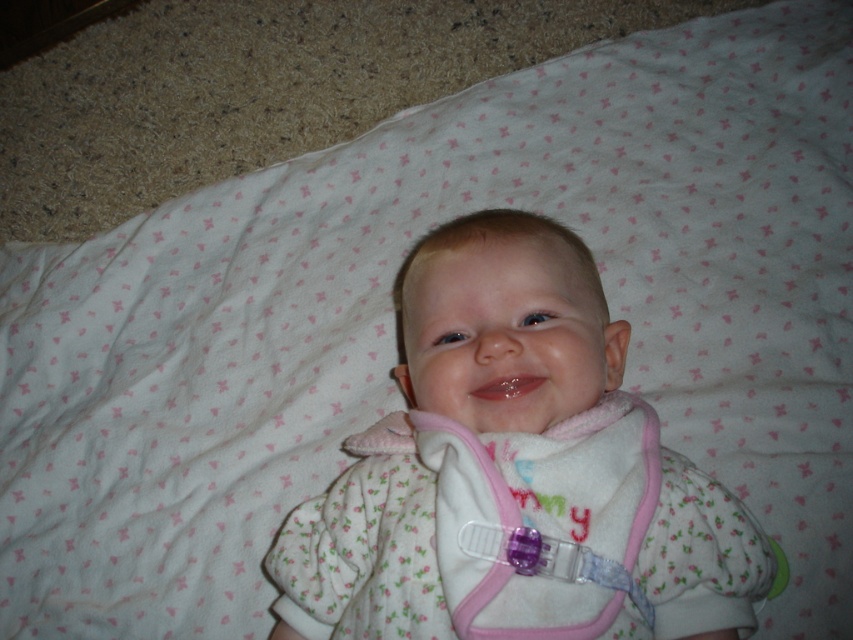
Between white fleece baby at center and pink fleece bib at center, which one appears on the right side from the viewer's perspective?

From the viewer's perspective, pink fleece bib at center appears more on the right side.

Which is behind, point (459, 408) or point (538, 531)?

The point (459, 408) is behind.

Does point (637, 403) come farther from viewer compared to point (456, 532)?

Yes, it is behind point (456, 532).

Locate an element on the screen. The image size is (853, 640). white fleece baby at center is located at coordinates (515, 472).